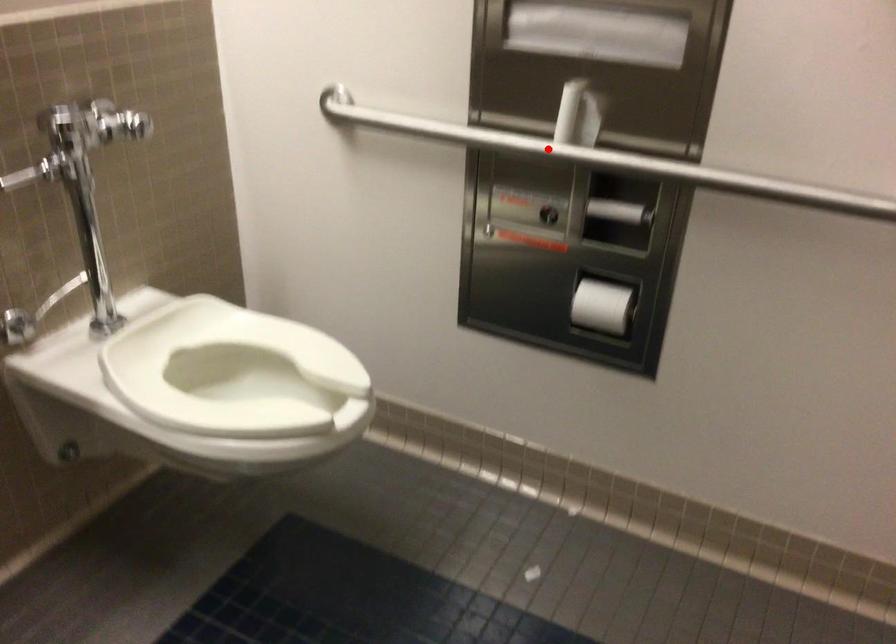
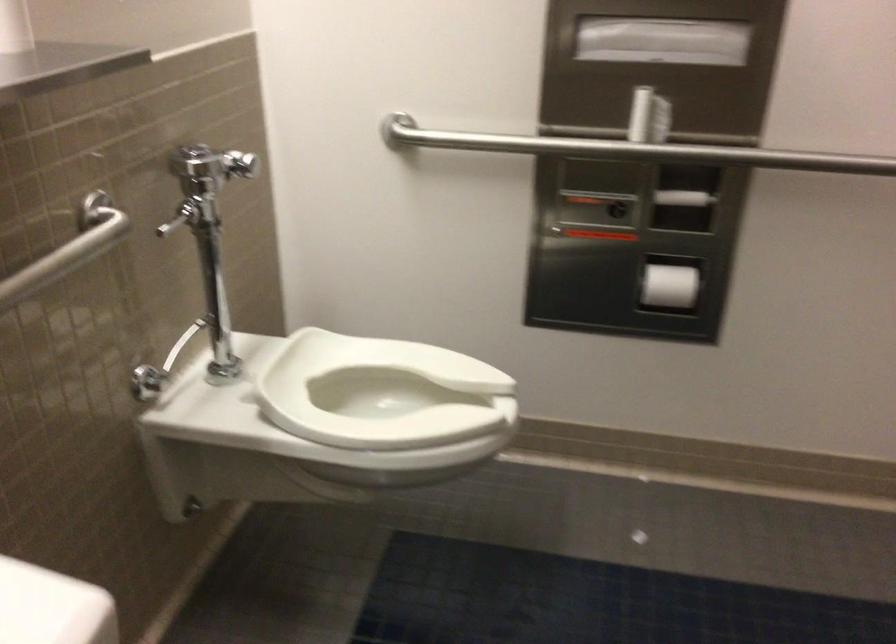
Find the pixel in the second image that matches the highlighted location in the first image.

(630, 149)